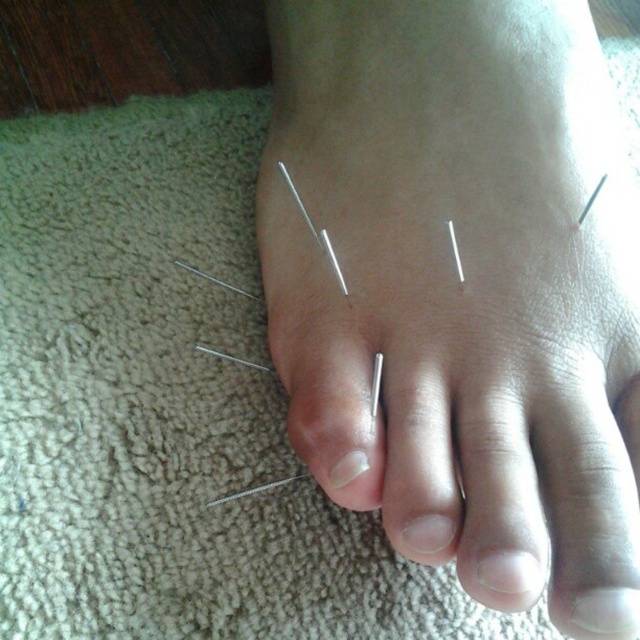
You are a photographer trying to capture a detailed closeup of the silver metallic needles at center. The camera you are using has a minimum focusing distance of 12 inches. Can you take the photo without moving the foot?

The silver metallic needles at center and camera are 13.28 inches apart, which is beyond the camera minimum focusing distance of 12 inches. Therefore, you cannot take the photo without moving the foot closer.

From the picture: You are a patient who just had acupuncture needles placed on your foot. You want to check if the metallic silver toe at center is positioned to the right of the metallic silver nail at center. Based on the image, is this true?

Yes, according to the image description, the metallic silver toe at center is indeed positioned to the right of the metallic silver nail at center.

You are a therapist examining a patient. You notice the silver metallic needles at center and the white matte nail at center. Which object is positioned to the left of the other?

The silver metallic needles at center are to the left of the white matte nail at center.